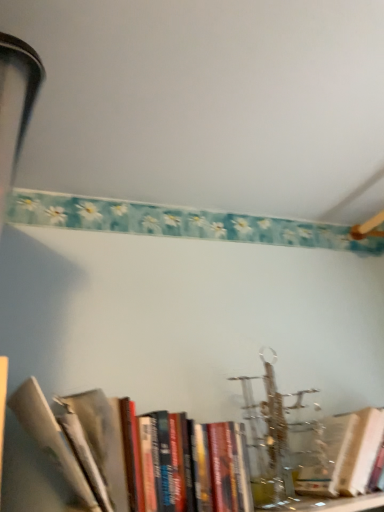
Question: In terms of width, does hardcover book at center, the first book viewed from the right, look wider or thinner when compared to hardcover books at lower left, acting as the first book starting from the left?

Choices:
 (A) thin
 (B) wide

Answer: (A)

Question: In terms of height, does hardcover book at center, the first book viewed from the right, look taller or shorter compared to hardcover books at lower left, which is the second book from right to left?

Choices:
 (A) tall
 (B) short

Answer: (B)

Question: Looking at the image, does hardcover book at center, the first book viewed from the right, seem bigger or smaller compared to hardcover books at lower left, which is the second book from right to left?

Choices:
 (A) small
 (B) big

Answer: (A)

Question: Would you say hardcover books at lower left, which is the second book from right to left, is inside or outside hardcover book at center, the first book viewed from the right?

Choices:
 (A) outside
 (B) inside

Answer: (A)

Question: Does point (261, 483) appear closer or farther from the camera than point (311, 475)?

Choices:
 (A) closer
 (B) farther

Answer: (A)

Question: From a real-world perspective, relative to hardcover book at center, which appears as the 2th book when viewed from the left, is hardcover books at lower left, acting as the first book starting from the left, vertically above or below?

Choices:
 (A) below
 (B) above

Answer: (B)

Question: Based on their sizes in the image, would you say hardcover books at lower left, acting as the first book starting from the left, is bigger or smaller than hardcover book at center, which appears as the 2th book when viewed from the left?

Choices:
 (A) small
 (B) big

Answer: (B)